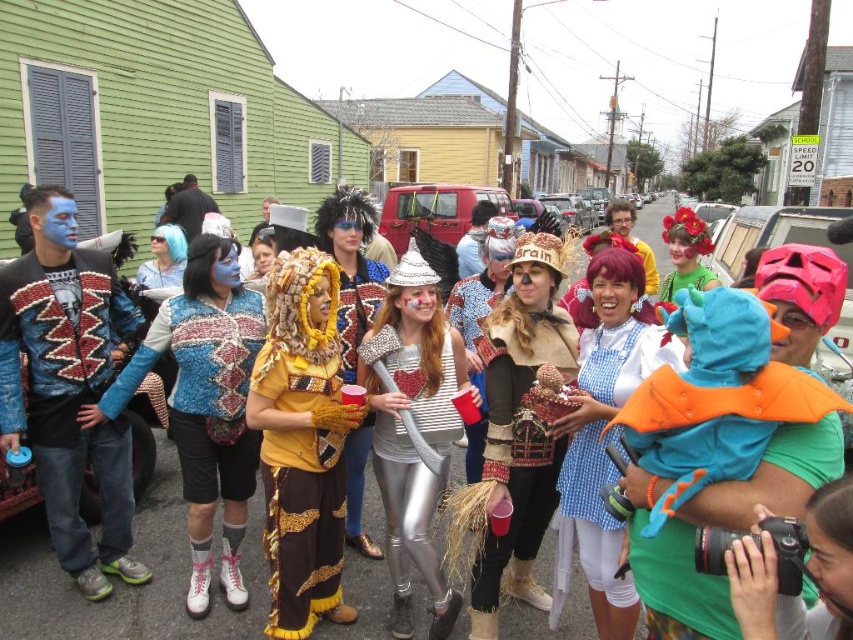
Question: Is beaded fabric scarecrow at center positioned at the back of silver metallic axe at center?

Choices:
 (A) yes
 (B) no

Answer: (B)

Question: Which object is farther from the camera taking this photo?

Choices:
 (A) matte blue face paint at left
 (B) blue fabric costume at center
 (C) silver metallic leggings at center
 (D) silver metallic axe at center

Answer: (D)

Question: Is beaded fabric scarecrow at center below blue fabric costume at center?

Choices:
 (A) no
 (B) yes

Answer: (A)

Question: Does blue fabric duck at center appear on the left side of silver metallic axe at center?

Choices:
 (A) no
 (B) yes

Answer: (A)

Question: Based on their relative distances, which object is nearer to the beaded fabric scarecrow at center?

Choices:
 (A) silver metallic leggings at center
 (B) blue fabric duck at center
 (C) matte blue face paint at left
 (D) gold sequined pants at center

Answer: (A)

Question: Which point is farther to the camera?

Choices:
 (A) (521, 548)
 (B) (405, 435)
 (C) (349, 310)
 (D) (45, 390)

Answer: (C)